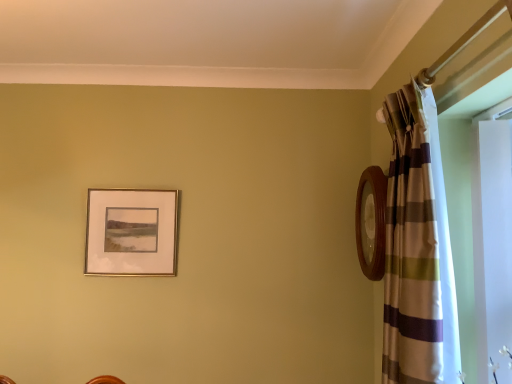
Question: Is gold metallic picture frame at upper left wider or thinner than striped fabric curtain at right?

Choices:
 (A) thin
 (B) wide

Answer: (A)

Question: Considering the positions of point (124, 251) and point (394, 271), is point (124, 251) closer or farther from the camera than point (394, 271)?

Choices:
 (A) farther
 (B) closer

Answer: (A)

Question: Is gold metallic picture frame at upper left inside the boundaries of striped fabric curtain at right, or outside?

Choices:
 (A) outside
 (B) inside

Answer: (A)

Question: Is striped fabric curtain at right taller or shorter than gold metallic picture frame at upper left?

Choices:
 (A) tall
 (B) short

Answer: (A)

Question: Does point (437, 380) appear closer or farther from the camera than point (158, 271)?

Choices:
 (A) farther
 (B) closer

Answer: (B)

Question: Is striped fabric curtain at right in front of or behind gold metallic picture frame at upper left in the image?

Choices:
 (A) front
 (B) behind

Answer: (A)

Question: From a real-world perspective, relative to gold metallic picture frame at upper left, is striped fabric curtain at right vertically above or below?

Choices:
 (A) below
 (B) above

Answer: (A)